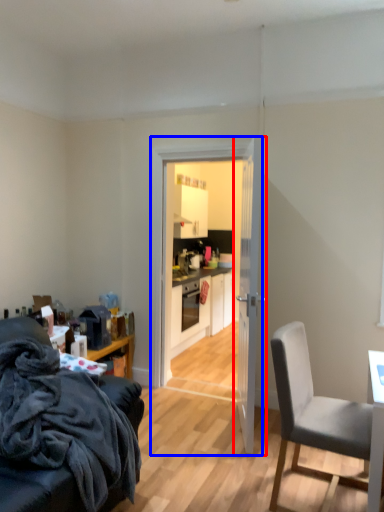
Question: Which point is closer to the camera, door (highlighted by a red box) or glass door (highlighted by a blue box)?

Choices:
 (A) door
 (B) glass door

Answer: (A)